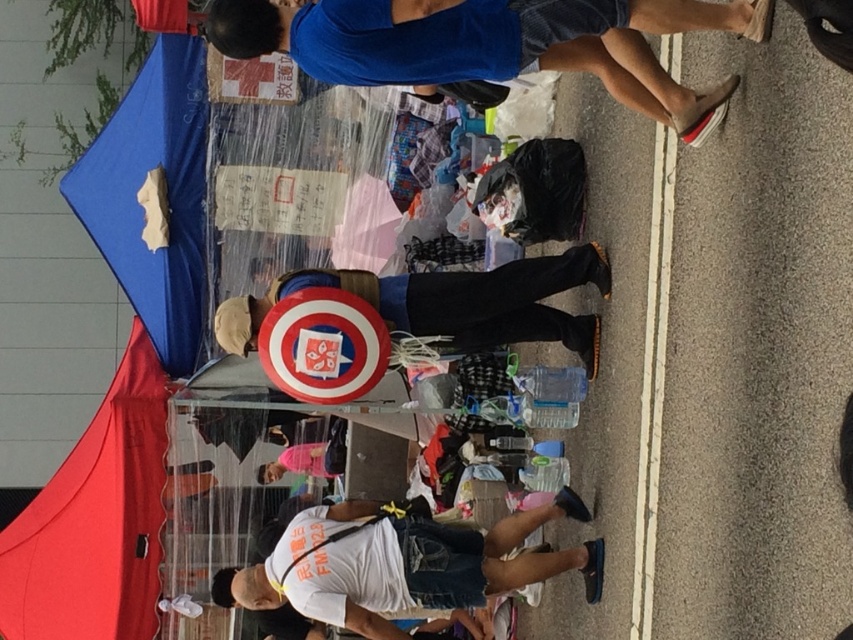
In the scene shown: You are a photographer trying to capture a clear shot of the captain america shield at center without the red fabric canopy at lower left blocking it. Given their heights, is this possible?

The red fabric canopy at lower left is much taller than the captain america shield at center, so it might block the view. To capture a clear shot, you should position yourself lower or move to a spot where the canopy is not in front of the shield.

You are a photographer trying to capture both the blue cotton shirt at upper center and the captain america shield at center in a single frame. Given their sizes, which object should you focus on first to ensure both are clearly visible in your photo?

The blue cotton shirt at upper center is larger in size than the captain america shield at center, so you should focus on the blue cotton shirt at upper center first to ensure both are clearly visible in your photo.